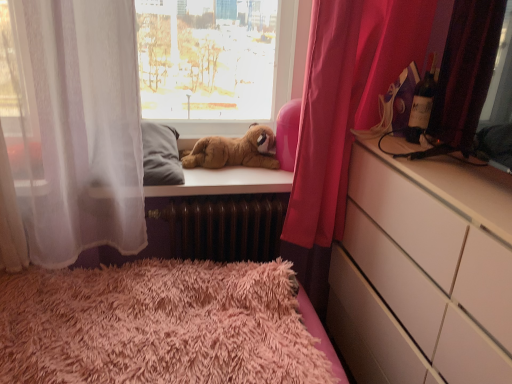
Question: Can you confirm if brown plush bear at upper center is thinner than pink fabric curtain at right, acting as the second curtain starting from the front?

Choices:
 (A) yes
 (B) no

Answer: (A)

Question: Would you say brown plush bear at upper center is outside pink fabric curtain at right, acting as the second curtain starting from the front?

Choices:
 (A) no
 (B) yes

Answer: (B)

Question: Is brown plush bear at upper center further to camera compared to pink fabric curtain at right, acting as the second curtain starting from the front?

Choices:
 (A) no
 (B) yes

Answer: (B)

Question: Is pink fabric curtain at right, which is the 1th curtain in back-to-front order, surrounded by brown plush bear at upper center?

Choices:
 (A) no
 (B) yes

Answer: (A)

Question: From a real-world perspective, is brown plush bear at upper center on top of pink fabric curtain at right, which is the 1th curtain in back-to-front order?

Choices:
 (A) no
 (B) yes

Answer: (A)

Question: Is velvet dark red curtain at right, marked as the second curtain in a back-to-front arrangement, in front of or behind matte glass bottle at right in the image?

Choices:
 (A) behind
 (B) front

Answer: (B)

Question: Is point (456, 56) positioned closer to the camera than point (407, 135)?

Choices:
 (A) closer
 (B) farther

Answer: (A)

Question: Is velvet dark red curtain at right, acting as the first curtain starting from the front, situated inside matte glass bottle at right or outside?

Choices:
 (A) outside
 (B) inside

Answer: (A)

Question: From the image's perspective, is velvet dark red curtain at right, acting as the first curtain starting from the front, located above or below matte glass bottle at right?

Choices:
 (A) below
 (B) above

Answer: (A)

Question: Considering the positions of white glossy chest of drawers at right and pink fabric curtain at right, which is the 1th curtain in back-to-front order, in the image, is white glossy chest of drawers at right wider or thinner than pink fabric curtain at right, which is the 1th curtain in back-to-front order,?

Choices:
 (A) thin
 (B) wide

Answer: (B)

Question: Is point (401, 309) positioned closer to the camera than point (360, 100)?

Choices:
 (A) farther
 (B) closer

Answer: (B)

Question: From the image's perspective, is white glossy chest of drawers at right located above or below pink fabric curtain at right, which is the 1th curtain in back-to-front order?

Choices:
 (A) below
 (B) above

Answer: (A)

Question: Considering their positions, is white glossy chest of drawers at right located in front of or behind pink fabric curtain at right, which is the 1th curtain in back-to-front order?

Choices:
 (A) front
 (B) behind

Answer: (A)

Question: Considering the positions of point (457, 183) and point (417, 89), is point (457, 183) closer or farther from the camera than point (417, 89)?

Choices:
 (A) farther
 (B) closer

Answer: (B)

Question: Is white glossy chest of drawers at right inside the boundaries of matte glass bottle at right, or outside?

Choices:
 (A) inside
 (B) outside

Answer: (B)